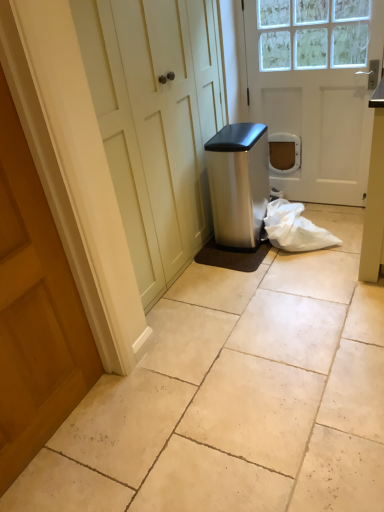
Question: Is white matte door at center, which is counted as the 2th door, starting from the left, facing towards satin silver trash can at center?

Choices:
 (A) no
 (B) yes

Answer: (B)

Question: Can you see white matte door at center, the 1th door when ordered from back to front, touching satin silver trash can at center?

Choices:
 (A) yes
 (B) no

Answer: (B)

Question: Is white matte door at center, the 1th door when ordered from back to front, wider than satin silver trash can at center?

Choices:
 (A) yes
 (B) no

Answer: (B)

Question: Is satin silver trash can at center located within white matte door at center, which is counted as the 2th door, starting from the left?

Choices:
 (A) yes
 (B) no

Answer: (B)

Question: From a real-world perspective, is white matte door at center, the 1th door when ordered from back to front, physically above satin silver trash can at center?

Choices:
 (A) yes
 (B) no

Answer: (A)

Question: Does point (249, 243) appear closer or farther from the camera than point (332, 74)?

Choices:
 (A) closer
 (B) farther

Answer: (B)

Question: Is satin silver trash can at center situated inside white matte door at center, the 1th door when ordered from back to front, or outside?

Choices:
 (A) inside
 (B) outside

Answer: (B)

Question: Is satin silver trash can at center in front of or behind white matte door at center, acting as the second door starting from the front, in the image?

Choices:
 (A) behind
 (B) front

Answer: (A)

Question: From a real-world perspective, is satin silver trash can at center positioned above or below white matte door at center, acting as the second door starting from the front?

Choices:
 (A) below
 (B) above

Answer: (A)

Question: From a real-world perspective, is satin silver trash can at center physically located above or below wooden door at left, the second door in the right-to-left sequence?

Choices:
 (A) above
 (B) below

Answer: (B)

Question: Considering the positions of satin silver trash can at center and wooden door at left, the second door in the right-to-left sequence, in the image, is satin silver trash can at center wider or thinner than wooden door at left, the second door in the right-to-left sequence,?

Choices:
 (A) wide
 (B) thin

Answer: (A)

Question: Considering their positions, is satin silver trash can at center located in front of or behind wooden door at left, the second door in the top-to-bottom sequence?

Choices:
 (A) front
 (B) behind

Answer: (B)

Question: From the image's perspective, is satin silver trash can at center located above or below wooden door at left, the second door in the right-to-left sequence?

Choices:
 (A) below
 (B) above

Answer: (B)

Question: Is white plastic bag at lower right taller or shorter than beige tile floor at center?

Choices:
 (A) short
 (B) tall

Answer: (B)

Question: Does point (334, 242) appear closer or farther from the camera than point (158, 385)?

Choices:
 (A) closer
 (B) farther

Answer: (B)